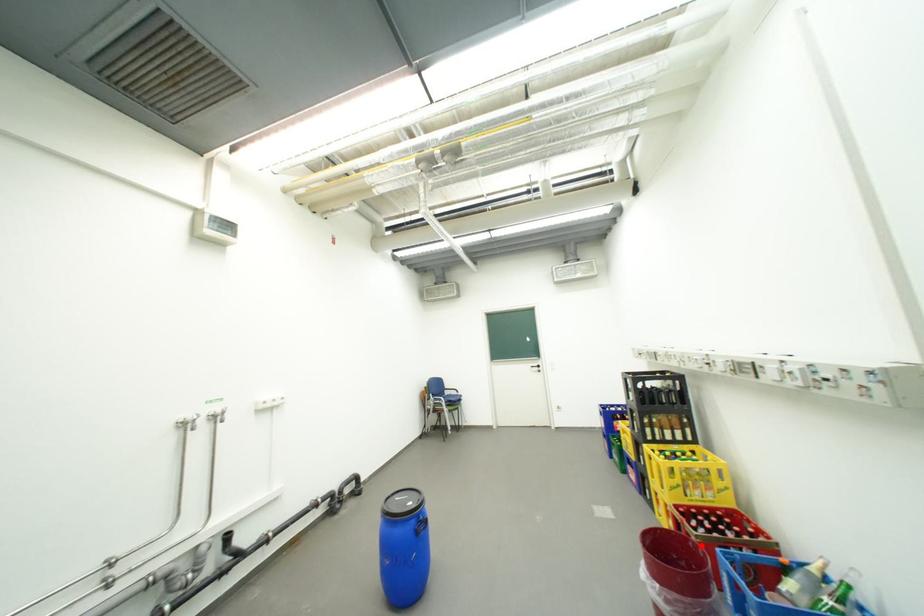
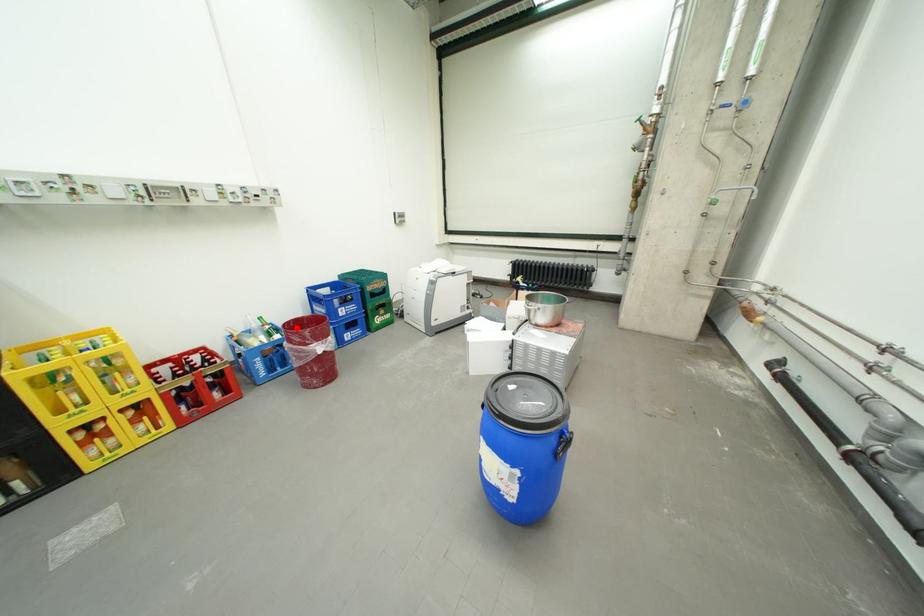
I am providing you with two images of the same scene from different viewpoints. A red point is marked on the first image and another point is marked on the second image. Does the point marked in image1 correspond to the same location as the one in image2?

Yes